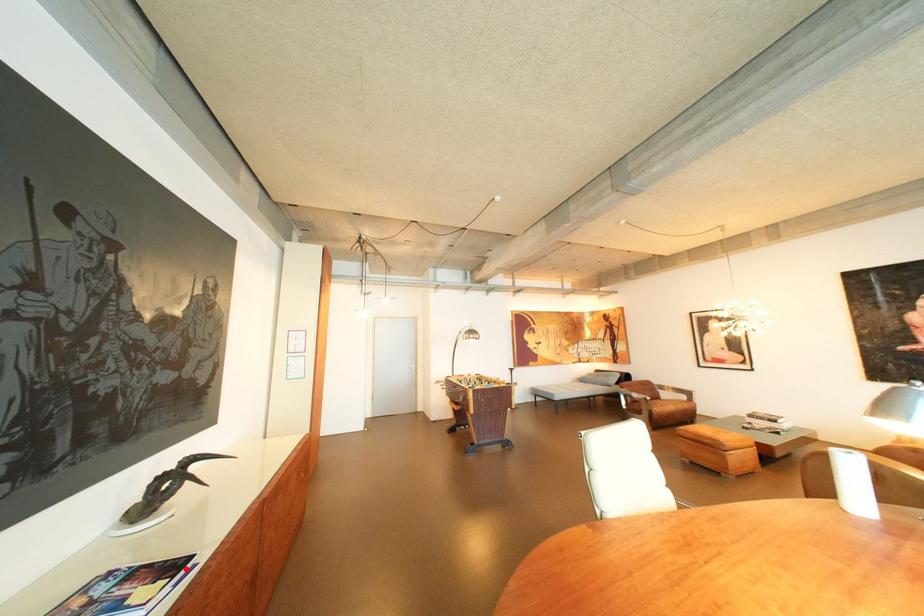
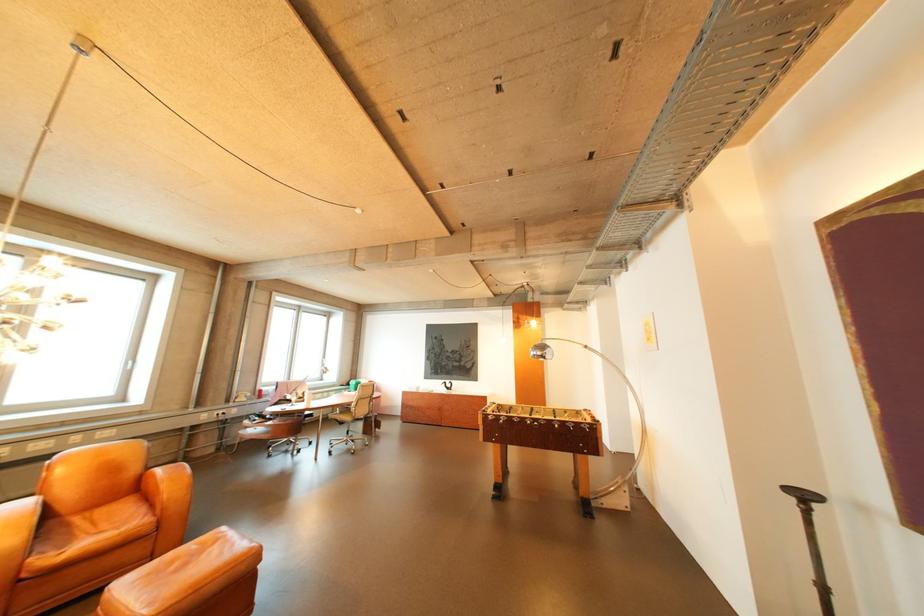
Question: I am providing you with two images of the same scene from different viewpoints. A red point is marked on the first image. At the location where the point appears in image 1, is it still visible in image 2?

Choices:
 (A) Yes
 (B) No

Answer: (B)